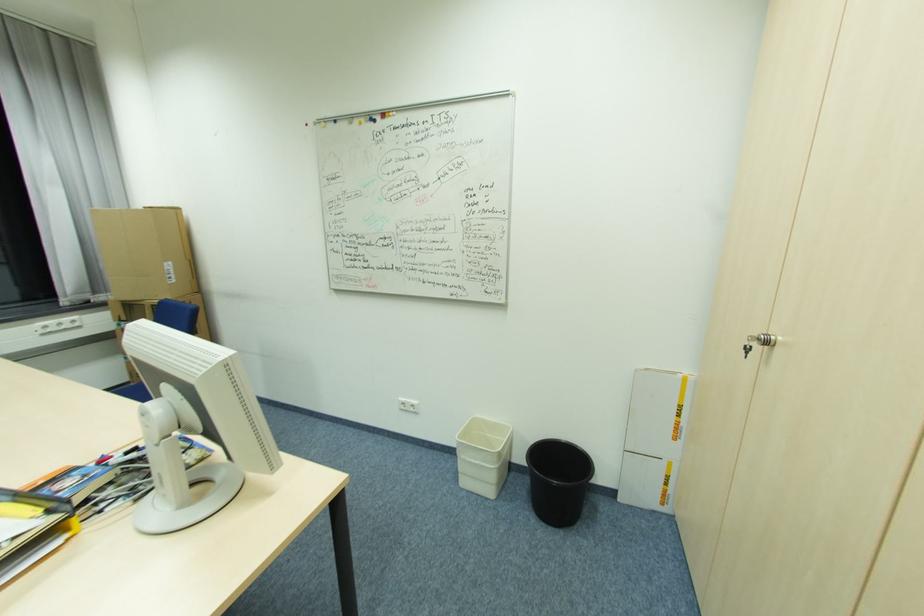
This screenshot has width=924, height=616. Identify the location of large cardboard box. (147, 264).